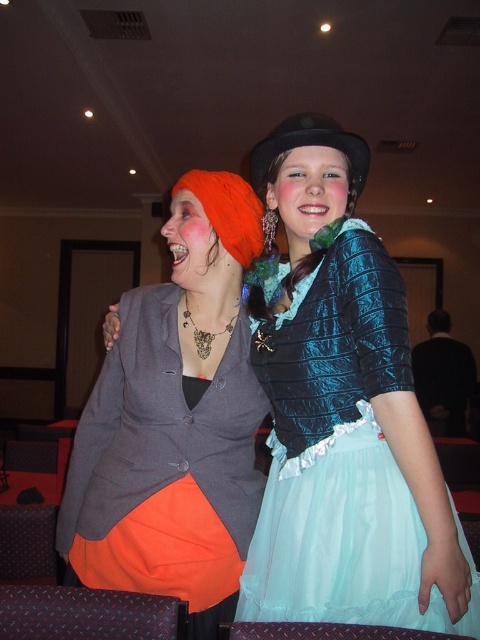
You are a photographer setting up for a group photo. You have a camera with a focal length of 50mm. The teal satin dress at center is the main subject. To ensure the dress is in focus, what distance should you set your camera to?

The teal satin dress at center is 36.36 inches from the camera, so you should set the camera focus distance to 36.36 inches to ensure the dress is in focus.

You are at the entrance of the room and want to find the teal satin dress at center. According to the coordinates provided, in which direction should you look to locate it?

The teal satin dress at center is located at coordinates point (339, 456), so you should look towards the lower right direction to find it.